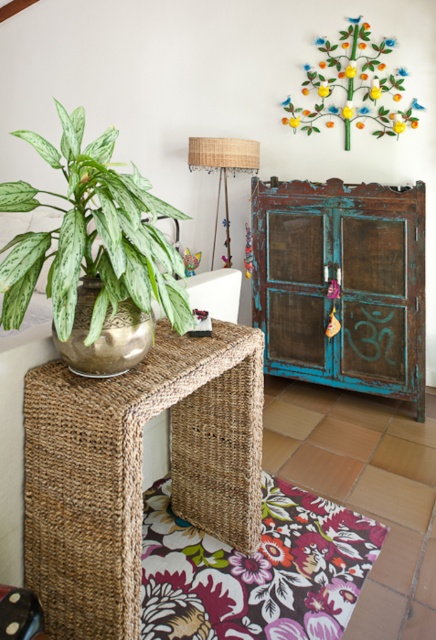
Does teal distressed wood cabinet at center have a lesser height compared to metallic green tree at upper right?

In fact, teal distressed wood cabinet at center may be taller than metallic green tree at upper right.

In the scene shown: Between teal distressed wood cabinet at center and metallic green tree at upper right, which one has less height?

With less height is metallic green tree at upper right.

Between point (364, 273) and point (309, 92), which one is positioned in front?

Point (364, 273) is more forward.

Image resolution: width=436 pixels, height=640 pixels. Identify the location of teal distressed wood cabinet at center. (341, 284).

Is green variegated leaf at left wider than woven fabric lampshade at center?

Yes, green variegated leaf at left is wider than woven fabric lampshade at center.

Does green variegated leaf at left lie behind woven fabric lampshade at center?

No.

Who is more forward, [113,305] or [190,147]?

Point [113,305]

The height and width of the screenshot is (640, 436). Find the location of `green variegated leaf at left`. green variegated leaf at left is located at coordinates (91, 236).

Does green variegated leaf at left have a lesser height compared to metallic green tree at upper right?

Yes.

Is point (89, 232) positioned in front of point (358, 22)?

Yes.

Which is in front, point (132, 276) or point (361, 38)?

Point (132, 276)

Image resolution: width=436 pixels, height=640 pixels. I want to click on green variegated leaf at left, so click(91, 236).